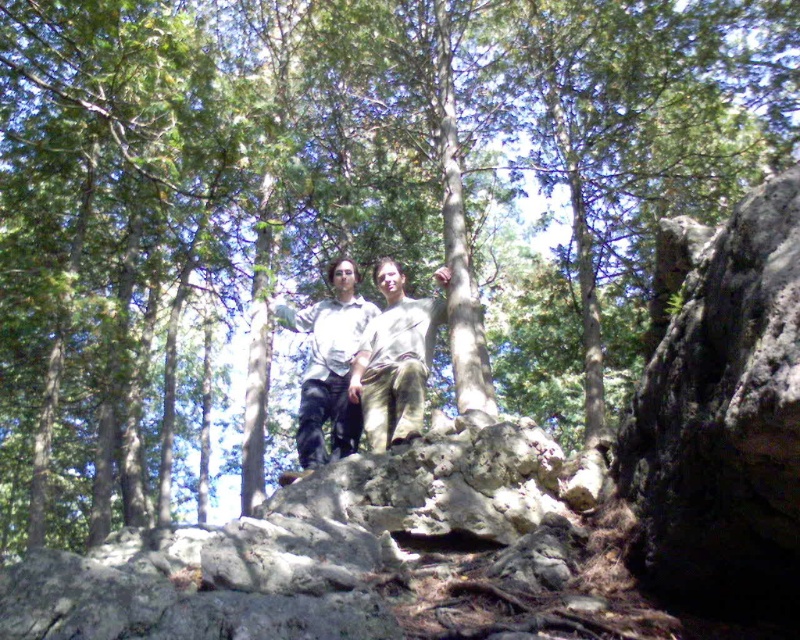
Based on the photo, you are a photographer trying to capture a clear shot of the light brown cotton pants at center. Since the pants are at point (394, 362), which is the central area of the image, where should you focus your camera to ensure the pants are in sharp focus?

You should focus your camera at point (394, 362) to ensure the light brown cotton pants at center are in sharp focus as that is their exact location.

You are a photographer trying to capture a clear photo of the light brown cotton pants at center and the light brown cotton shirt at center. Which one is blocking the view of the other?

The light brown cotton pants at center is in front of light brown cotton shirt at center, so the light brown cotton pants at center is blocking the view of the light brown cotton shirt at center.

Looking at this image, you are a photographer trying to capture a clear shot of the light brown cotton pants at center and the light brown cotton shirt at center. Which clothing item would you focus on first if you want to ensure both are in focus, considering their positions?

The light brown cotton pants at center is shorter than the light brown cotton shirt at center. Since the pants are shorter, they are closer to the camera, so focusing on the pants first would ensure both are in focus as the shirt is further back.